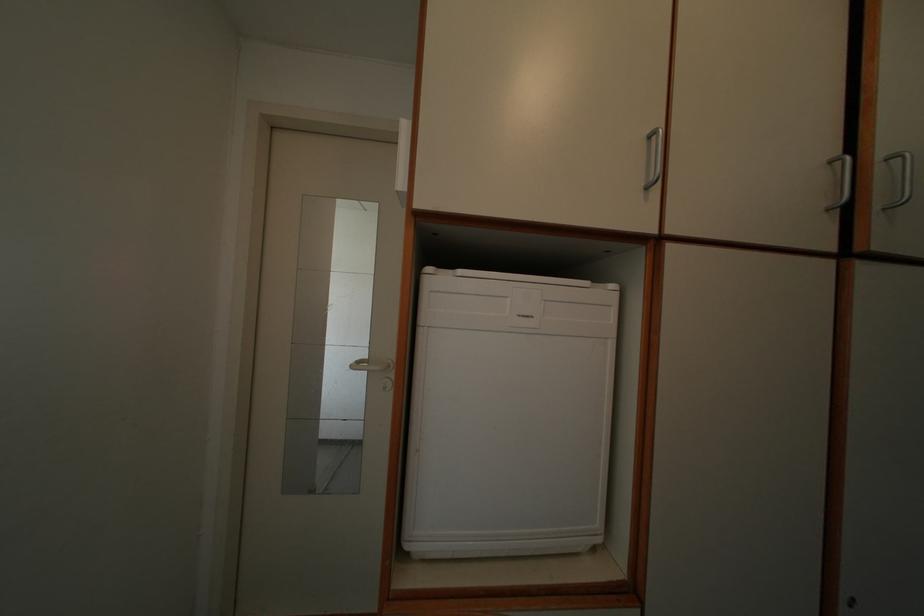
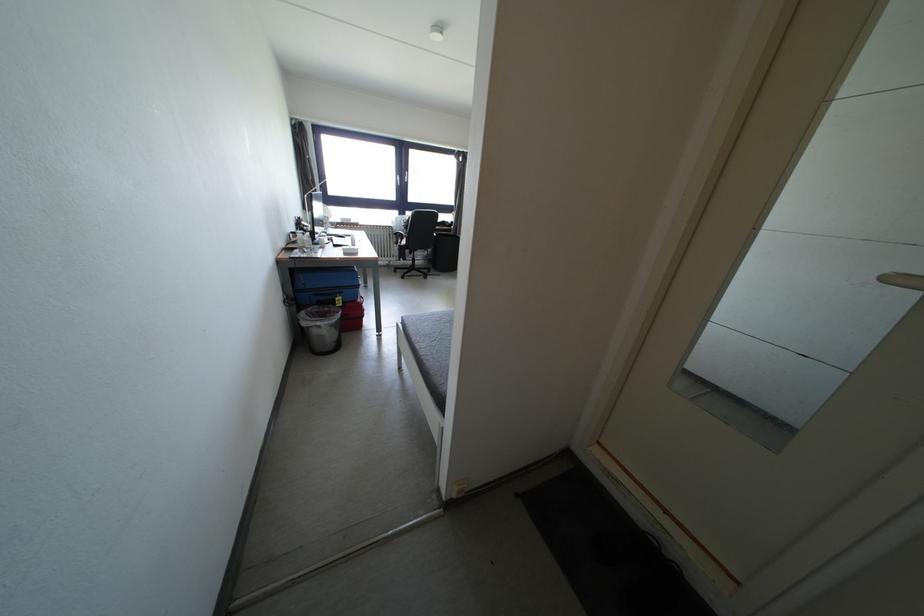
The point at (363, 369) is marked in the first image. Where is the corresponding point in the second image?

(898, 284)